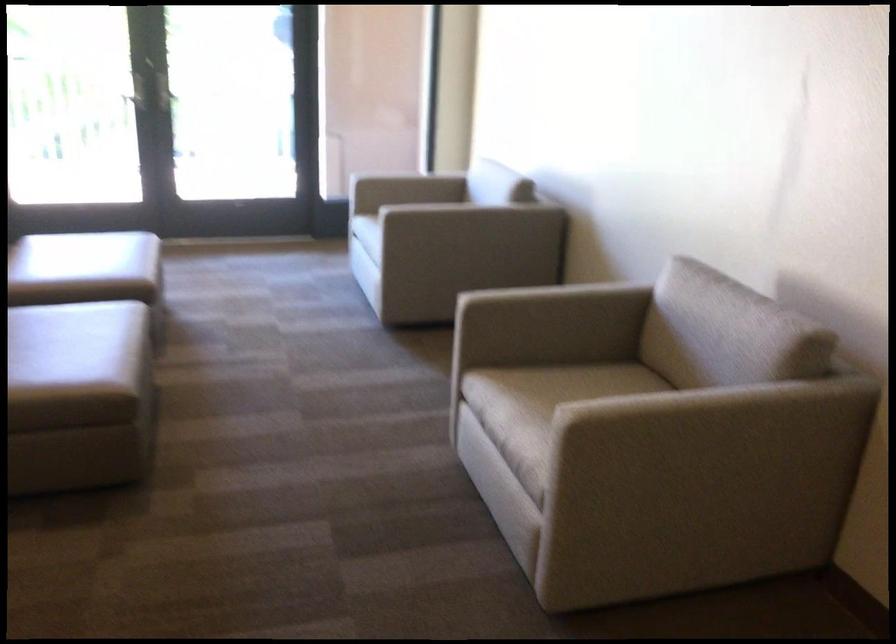
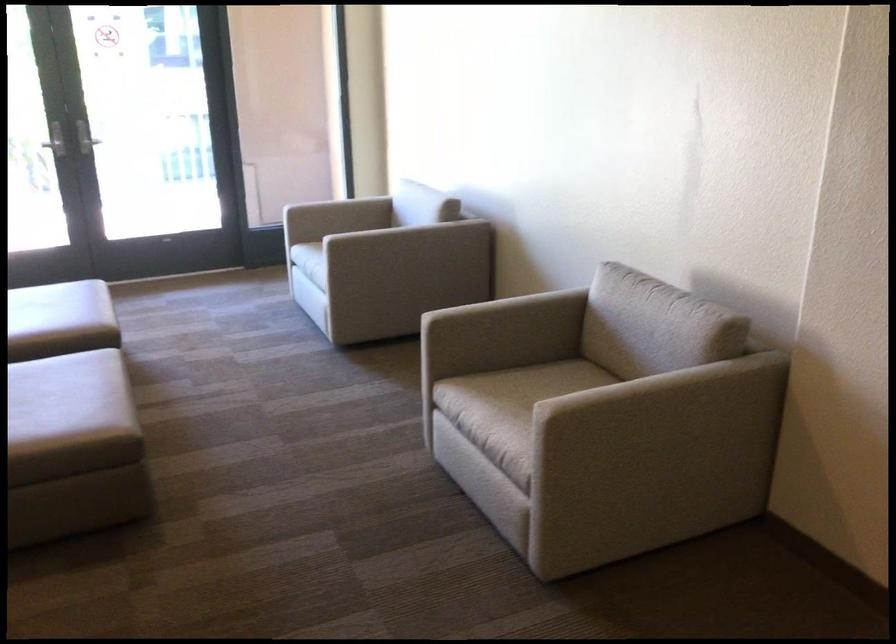
Question: Based on the continuous images, in which direction is the camera rotating? Reply with the corresponding letter.

Choices:
 (A) Left
 (B) Right
 (C) Up
 (D) Down

Answer: (B)